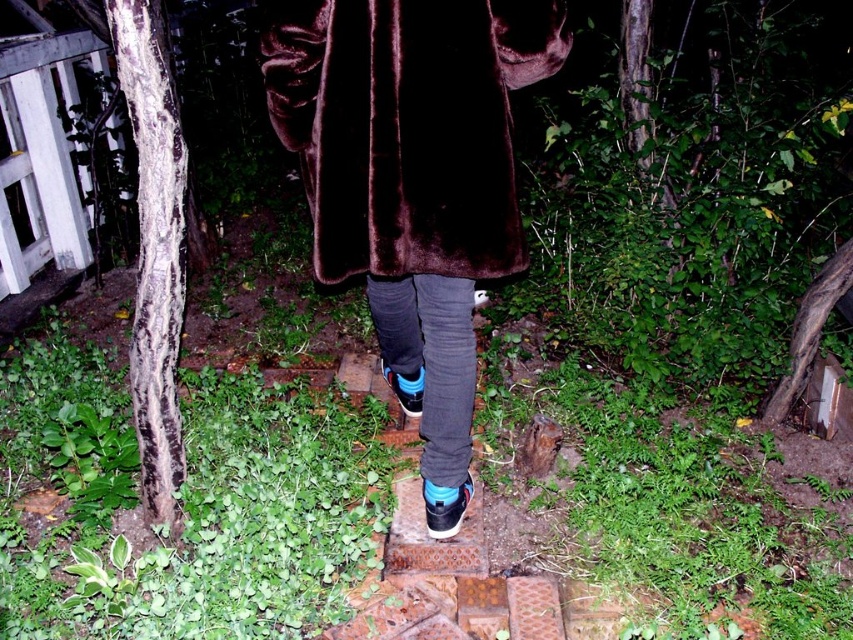
Question: Is velvety brown coat at center to the left of shiny black sneaker at center from the viewer's perspective?

Choices:
 (A) yes
 (B) no

Answer: (A)

Question: Based on their relative distances, which object is farther from the shiny black sneaker at center?

Choices:
 (A) suede black shoe at center
 (B) speckled bark tree trunk at left
 (C) velvety brown coat at center

Answer: (C)

Question: Does speckled bark tree trunk at left have a smaller size compared to shiny black sneaker at center?

Choices:
 (A) yes
 (B) no

Answer: (B)

Question: Which object appears closest to the camera in this image?

Choices:
 (A) shiny black sneaker at center
 (B) speckled bark tree trunk at left

Answer: (B)

Question: From the image, what is the correct spatial relationship of velvety brown coat at center in relation to speckled bark tree trunk at left?

Choices:
 (A) right
 (B) left

Answer: (A)

Question: Among these objects, which one is nearest to the camera?

Choices:
 (A) speckled bark tree trunk at left
 (B) shiny black sneaker at center

Answer: (A)